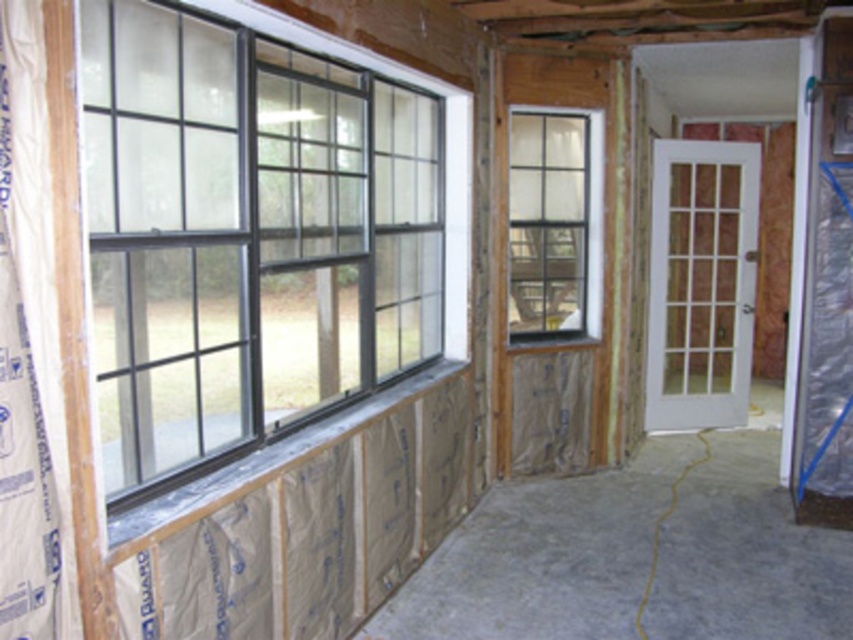
You are an interior designer assessing the room. You need to determine the placement of a large sofa that will face the windows. Given the positions of the black matte window at left and the clear glass window at center, which window should the sofa face to maximize natural light while maintaining privacy?

The clear glass window at center should be the one the sofa faces because it is positioned to the right of the black matte window at left, likely allowing more direct sunlight. The black matte window at left, being to the left, might provide less privacy due to its position or material, though the description specifies it is matte, which could still offer privacy. However, the clear glass might allow better light while the matte could be more private. Wait, the Objects Description says the black matte is to

You are an interior designer planning to install custom window treatments. You have two windows in the room described. The black matte window at left and the clear glass window at center. Which window requires longer curtains based on their height?

The black matte window at left requires longer curtains because it is much taller than the clear glass window at center.

You are standing in the construction site and want to move from the point at coordinates point (201, 289) to the point at coordinates point (555, 280). Will you have to walk behind the first point to reach the second point?

Point (201, 289) is in front of point (555, 280), so you will have to walk behind the first point to reach the second point.